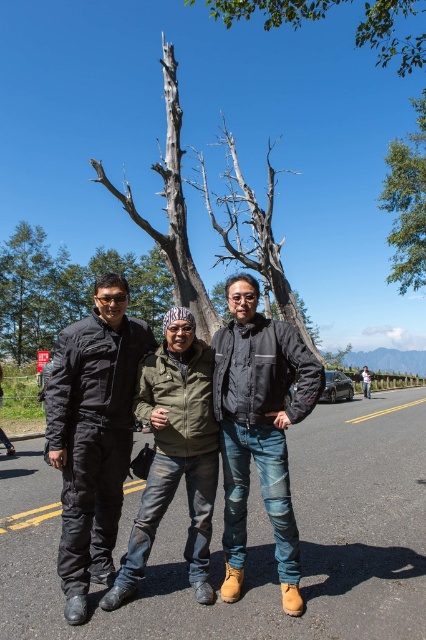
You are a photographer trying to capture a group photo of the three people in the image. You want to ensure that both the green matte jacket at center and the denim jacket at center are clearly visible in the frame. Given their sizes, which jacket should you focus on positioning closer to the camera to ensure both are equally visible?

The green matte jacket at center occupies less space than the denim jacket at center. To make both jackets equally visible, you should position the green matte jacket at center closer to the camera since it is smaller and needs to be magnified to match the visibility of the larger denim jacket at center.

You are a photographer trying to capture a group photo of the three people in the scene. You want to ensure that the green leafy tree at upper center and the denim jacket at center are both clearly visible in the frame. Based on their sizes, which object might require you to adjust your camera angle to include it fully?

The green leafy tree at upper center might be wider than the denim jacket at center, so you may need to adjust your camera angle to ensure the entire tree is captured in the frame.

You are a photographer trying to capture the green matte jacket at center and denim jacket at center in a single frame. Based on their positions, which jacket is higher up in the image?

The green matte jacket at center is above denim jacket at center, so the green matte jacket at center is higher up in the image.